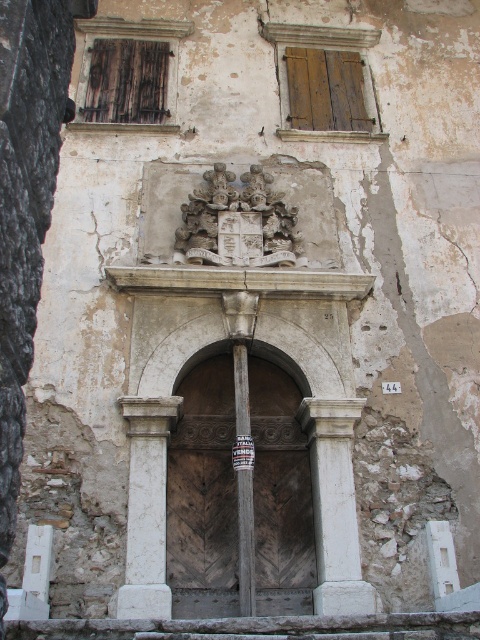
Based on the photo, you are an architect assessing the entrance of an old building. You notice two central elements at the entrance. Which one is narrower? The wooden at center or the white stone coat of arms at center?

The wooden at center has a lesser width compared to the white stone coat of arms at center, so the wooden at center is narrower.

You are an architect examining the entrance of an old building. You notice two central elements at the entrance. One is the wooden at center and the other is the white stone coat of arms at center. Which of these two elements is larger in size?

The wooden at center is bigger than the white stone coat of arms at center.

You are standing at the entrance of the old building and notice two wooden elements. The first is the wooden at center, and the second is the wooden post at center. Which one is positioned lower in relation to the other?

The wooden at center is located below the wooden post at center, so it is positioned lower.